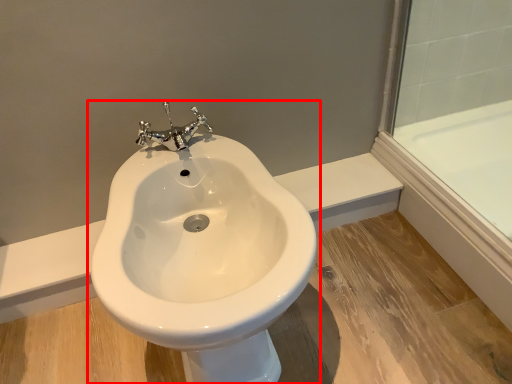
Question: Considering the relative positions of toilet (annotated by the red box) and glass door in the image provided, where is toilet (annotated by the red box) located with respect to the staircase?

Choices:
 (A) left
 (B) right

Answer: (A)